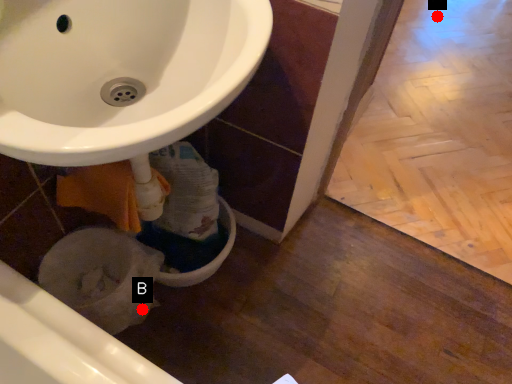
Question: Two points are circled on the image, labeled by A and B beside each circle. Which point is closer to the camera?

Choices:
 (A) A is closer
 (B) B is closer

Answer: (B)